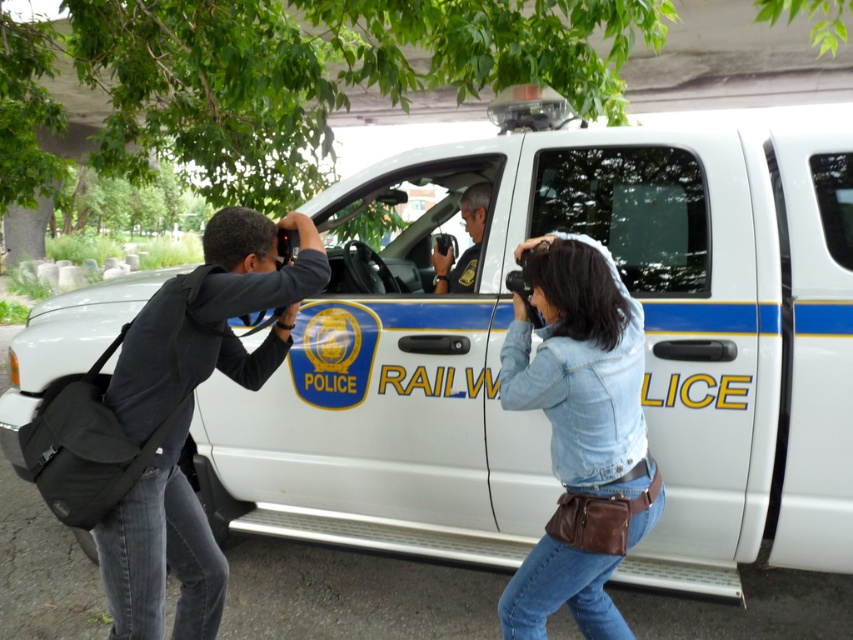
Is denim jacket at lower right below dark gray hoodie at left?

Indeed, denim jacket at lower right is positioned under dark gray hoodie at left.

Between denim jacket at lower right and dark gray hoodie at left, which one is positioned lower?

denim jacket at lower right is lower down.

The image size is (853, 640). Describe the element at coordinates (579, 433) in the screenshot. I see `denim jacket at lower right` at that location.

At what (x,y) coordinates should I click in order to perform the action: click on denim jacket at lower right. Please return your answer as a coordinate pair (x, y). Looking at the image, I should click on (579, 433).

From the picture: Can you confirm if denim jacket at lower right is positioned to the left of matte black uniform at center?

In fact, denim jacket at lower right is to the right of matte black uniform at center.

Can you confirm if denim jacket at lower right is smaller than matte black uniform at center?

No, denim jacket at lower right is not smaller than matte black uniform at center.

Is point (636, 496) less distant than point (469, 273)?

Yes.

Where is `denim jacket at lower right`? denim jacket at lower right is located at coordinates (579, 433).

Does point (224, 273) lie in front of point (459, 202)?

Yes, it is in front of point (459, 202).

Between dark gray hoodie at left and matte black uniform at center, which one has more height?

Standing taller between the two is dark gray hoodie at left.

Does point (194, 563) come behind point (477, 228)?

No, (194, 563) is closer to viewer.

Find the location of a particular element. The height and width of the screenshot is (640, 853). dark gray hoodie at left is located at coordinates (190, 416).